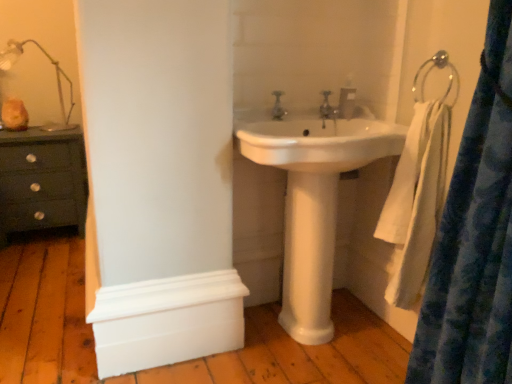
This screenshot has width=512, height=384. What do you see at coordinates (167, 321) in the screenshot?
I see `white painted wood molding at lower left` at bounding box center [167, 321].

Where is `white painted wood molding at lower left`? This screenshot has width=512, height=384. white painted wood molding at lower left is located at coordinates (167, 321).

The width and height of the screenshot is (512, 384). Describe the element at coordinates (474, 237) in the screenshot. I see `blue textured curtain at right` at that location.

Where is `matte silver faucet at center, marked as the 1th tap in a left-to-right arrangement`? The height and width of the screenshot is (384, 512). matte silver faucet at center, marked as the 1th tap in a left-to-right arrangement is located at coordinates (278, 106).

What is the approximate height of matte silver faucet at center, the second tap positioned from the back?

The height of matte silver faucet at center, the second tap positioned from the back, is 4.24 inches.

Where is `dark wood chest of drawers at left`? The height and width of the screenshot is (384, 512). dark wood chest of drawers at left is located at coordinates (42, 181).

Where is `silver metallic faucet at center, positioned as the first tap in right-to-left order`? This screenshot has height=384, width=512. silver metallic faucet at center, positioned as the first tap in right-to-left order is located at coordinates (327, 109).

Is point (326, 107) closer to camera compared to point (371, 143)?

No, it is not.

Does silver metallic faucet at center, acting as the first tap starting from the back, have a greater width compared to white glossy sink at center?

Incorrect, the width of silver metallic faucet at center, acting as the first tap starting from the back, does not surpass that of white glossy sink at center.

Is silver metallic faucet at center, the second tap from the left, positioned before white glossy sink at center?

No, silver metallic faucet at center, the second tap from the left, is further to the viewer.

Is silver metallic faucet at center, positioned as the first tap in right-to-left order, not inside white glossy sink at center?

No, most part of silver metallic faucet at center, positioned as the first tap in right-to-left order, lies within white glossy sink at center.

Locate an element on the screen. The height and width of the screenshot is (384, 512). chest of drawers behind the white glossy pedestal at center is located at coordinates (42, 181).

Looking at this image, considering the relative positions of white glossy pedestal at center and dark wood chest of drawers at left in the image provided, is white glossy pedestal at center to the left or to the right of dark wood chest of drawers at left?

Based on their positions, white glossy pedestal at center is located to the right of dark wood chest of drawers at left.

Which object is further away from the camera taking this photo, white glossy pedestal at center or dark wood chest of drawers at left?

dark wood chest of drawers at left is more distant.

Is white glossy pedestal at center spatially inside dark wood chest of drawers at left, or outside of it?

white glossy pedestal at center is not enclosed by dark wood chest of drawers at left.

Which of these two, white painted wood molding at lower left or blue textured curtain at right, is thinner?

With smaller width is white painted wood molding at lower left.

From a real-world perspective, is white painted wood molding at lower left positioned above or below blue textured curtain at right?

In terms of real-world spatial position, white painted wood molding at lower left is below blue textured curtain at right.

Considering the relative sizes of white painted wood molding at lower left and blue textured curtain at right in the image provided, is white painted wood molding at lower left shorter than blue textured curtain at right?

Indeed, white painted wood molding at lower left has a lesser height compared to blue textured curtain at right.

In terms of size, does white painted wood molding at lower left appear bigger or smaller than blue textured curtain at right?

In the image, white painted wood molding at lower left appears to be smaller than blue textured curtain at right.

Is silver metallic faucet at center, acting as the first tap starting from the back, not near dark wood chest of drawers at left?

silver metallic faucet at center, acting as the first tap starting from the back, is positioned a significant distance from dark wood chest of drawers at left.

In terms of height, does silver metallic faucet at center, positioned as the first tap in right-to-left order, look taller or shorter compared to dark wood chest of drawers at left?

In the image, silver metallic faucet at center, positioned as the first tap in right-to-left order, appears to be shorter than dark wood chest of drawers at left.

Which is in front, silver metallic faucet at center, marked as the second tap in a front-to-back arrangement, or dark wood chest of drawers at left?

silver metallic faucet at center, marked as the second tap in a front-to-back arrangement, is closer to the camera.

Consider the image. Is silver metallic faucet at center, the second tap from the left, oriented away from dark wood chest of drawers at left?

No, silver metallic faucet at center, the second tap from the left,'s orientation is not away from dark wood chest of drawers at left.

Can you see translucent glass lamp at upper left touching silver metallic faucet at center, the second tap from the left?

They are not placed beside each other.

Does translucent glass lamp at upper left have a lesser height compared to silver metallic faucet at center, marked as the second tap in a front-to-back arrangement?

Incorrect, the height of translucent glass lamp at upper left does not fall short of that of silver metallic faucet at center, marked as the second tap in a front-to-back arrangement.

From the image's perspective, which one is positioned lower, translucent glass lamp at upper left or silver metallic faucet at center, the second tap from the left?

silver metallic faucet at center, the second tap from the left, appears lower in the image.

Is white painted wood molding at lower left positioned in front of white glossy pedestal at center?

Yes, the depth of white painted wood molding at lower left is less than that of white glossy pedestal at center.

Consider the image. Is white painted wood molding at lower left located outside white glossy pedestal at center?

Yes, white painted wood molding at lower left is not within white glossy pedestal at center.

From the image's perspective, who appears lower, white painted wood molding at lower left or white glossy pedestal at center?

white painted wood molding at lower left, from the image's perspective.

Locate an element on the screen. Image resolution: width=512 pixels, height=384 pixels. porcelain above the white painted wood molding at lower left (from a real-world perspective) is located at coordinates click(309, 256).

Which of these two, translucent glass lamp at upper left or matte silver faucet at center, marked as the 1th tap in a left-to-right arrangement, stands taller?

Standing taller between the two is translucent glass lamp at upper left.

Is translucent glass lamp at upper left smaller than matte silver faucet at center, positioned as the 1th tap in front-to-back order?

No.

From a real-world perspective, is translucent glass lamp at upper left under matte silver faucet at center, marked as the 1th tap in a left-to-right arrangement?

Incorrect, from a real-world perspective, translucent glass lamp at upper left is higher than matte silver faucet at center, marked as the 1th tap in a left-to-right arrangement.

Considering the sizes of translucent glass lamp at upper left and matte silver faucet at center, the 2th tap from the right, in the image, is translucent glass lamp at upper left wider or thinner than matte silver faucet at center, the 2th tap from the right,?

In the image, translucent glass lamp at upper left appears to be wider than matte silver faucet at center, the 2th tap from the right.

From the image's perspective, which tap is the 2nd one above the white glossy sink at center? Please provide its 2D coordinates.

[(327, 109)]

This screenshot has height=384, width=512. In the image, there is a dark wood chest of drawers at left. In order to click on porcelain below it (from a real-world perspective) in this screenshot , I will do `click(309, 256)`.

Considering their positions, is blue textured curtain at right positioned closer to white glossy sink at center than metallic silver towel ring at upper right?

Based on the image, metallic silver towel ring at upper right appears to be nearer to white glossy sink at center.

Considering their positions, is white glossy pedestal at center positioned further to metallic silver towel ring at upper right than blue textured curtain at right?

Based on the image, white glossy pedestal at center appears to be further to metallic silver towel ring at upper right.

Estimate the real-world distances between objects in this image. Which object is further from white painted wood molding at lower left, white glossy sink at center or silver metallic faucet at center, marked as the second tap in a front-to-back arrangement?

silver metallic faucet at center, marked as the second tap in a front-to-back arrangement, is further to white painted wood molding at lower left.

Considering their positions, is silver metallic faucet at center, the second tap from the left, positioned closer to blue textured curtain at right than white glossy pedestal at center?

Based on the image, white glossy pedestal at center appears to be nearer to blue textured curtain at right.

Looking at the image, which one is located closer to blue textured curtain at right, translucent glass lamp at upper left or matte silver faucet at center, marked as the 1th tap in a left-to-right arrangement?

Based on the image, matte silver faucet at center, marked as the 1th tap in a left-to-right arrangement, appears to be nearer to blue textured curtain at right.

Considering their positions, is blue textured curtain at right positioned closer to dark wood chest of drawers at left than metallic silver towel ring at upper right?

metallic silver towel ring at upper right is positioned closer to the anchor dark wood chest of drawers at left.

Estimate the real-world distances between objects in this image. Which object is closer to silver metallic faucet at center, positioned as the first tap in right-to-left order, white painted wood molding at lower left or translucent glass lamp at upper left?

white painted wood molding at lower left lies closer to silver metallic faucet at center, positioned as the first tap in right-to-left order, than the other object.

Which object lies further to the anchor point white glossy pedestal at center, silver metallic faucet at center, the second tap from the left, or white glossy sink at center?

Based on the image, silver metallic faucet at center, the second tap from the left, appears to be further to white glossy pedestal at center.

Locate an element on the screen. The image size is (512, 384). molding located between blue textured curtain at right and silver metallic faucet at center, marked as the second tap in a front-to-back arrangement, in the depth direction is located at coordinates (167, 321).

Find the location of a particular element. The width and height of the screenshot is (512, 384). tap located between dark wood chest of drawers at left and silver metallic faucet at center, positioned as the first tap in right-to-left order, in the left-right direction is located at coordinates (278, 106).

Image resolution: width=512 pixels, height=384 pixels. Find the location of `sink between white painted wood molding at lower left and blue textured curtain at right in the horizontal direction`. sink between white painted wood molding at lower left and blue textured curtain at right in the horizontal direction is located at coordinates (319, 143).

This screenshot has width=512, height=384. What are the coordinates of `porcelain situated between dark wood chest of drawers at left and silver metallic faucet at center, the second tap from the left, from left to right` in the screenshot? It's located at (309, 256).